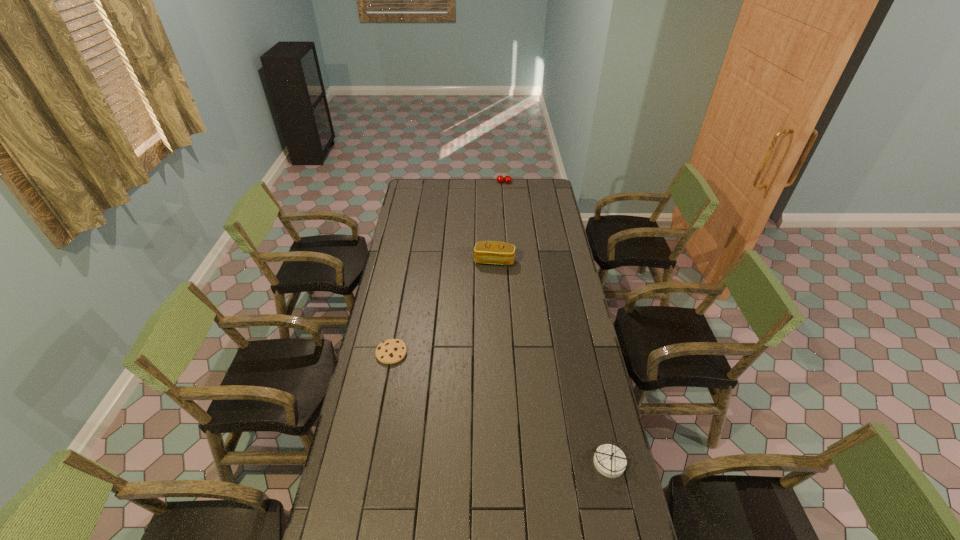
Identify the location of free spot between the tallest object and the shortest object. (447, 267).

At what (x,y) coordinates should I click in order to perform the action: click on free space between the tallest object and the nearest object. Please return your answer as a coordinate pair (x, y). Image resolution: width=960 pixels, height=540 pixels. Looking at the image, I should click on (557, 323).

Locate an element on the screen. free space between the second tallest object and the farthest object is located at coordinates (499, 221).

Locate an element on the screen. Image resolution: width=960 pixels, height=540 pixels. the second closest object relative to the cherry is located at coordinates (391, 351).

Identify the location of object that is the third closest to the cookie. This screenshot has width=960, height=540. (500, 179).

Identify the location of blank space that satisfies the following two spatial constraints: 1. on the back side of the farthest object; 2. on the left side of the leftmost object. This screenshot has width=960, height=540. (423, 182).

Locate an element on the screen. free spot that satisfies the following two spatial constraints: 1. on the front side of the shortest object; 2. on the left side of the compass is located at coordinates (371, 463).